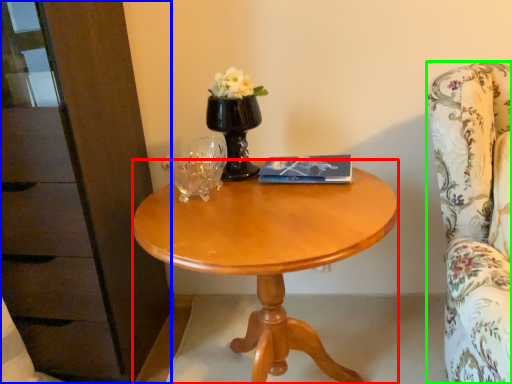
Question: Considering the real-world distances, which object is closest to desk (highlighted by a red box)? dresser (highlighted by a blue box) or chair (highlighted by a green box).

Choices:
 (A) dresser
 (B) chair

Answer: (B)